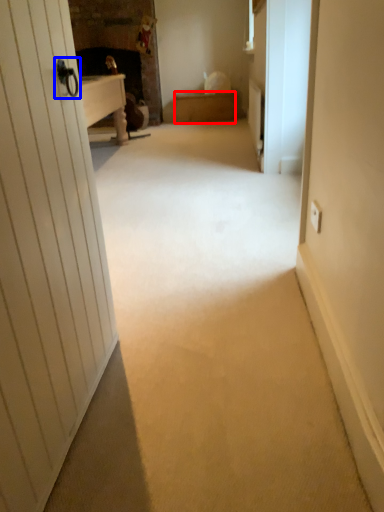
Question: Which point is further to the camera, furniture (highlighted by a red box) or door handle (highlighted by a blue box)?

Choices:
 (A) furniture
 (B) door handle

Answer: (B)